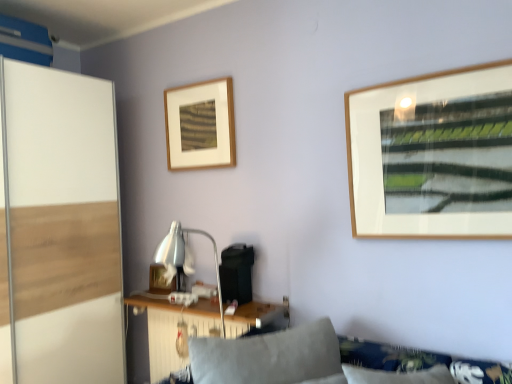
Locate an element on the screen. The width and height of the screenshot is (512, 384). wooden table at lower center is located at coordinates (170, 328).

Locate an element on the screen. This screenshot has width=512, height=384. wooden table at lower center is located at coordinates click(170, 328).

Is white glossy screen door at left taller than soft gray cushion at lower center?

Correct, white glossy screen door at left is much taller as soft gray cushion at lower center.

In the image, is white glossy screen door at left positioned in front of or behind soft gray cushion at lower center?

white glossy screen door at left is positioned farther from the viewer than soft gray cushion at lower center.

Is white glossy screen door at left positioned with its back to soft gray cushion at lower center?

No, soft gray cushion at lower center is not at the back of white glossy screen door at left.

From the image's perspective, is white glossy screen door at left over soft gray cushion at lower center?

Indeed, from the image's perspective, white glossy screen door at left is shown above soft gray cushion at lower center.

Are wooden picture frame at upper center, which is the first picture frame from right to left, and soft gray cushion at lower center located far from each other?

wooden picture frame at upper center, which is the first picture frame from right to left, is positioned a significant distance from soft gray cushion at lower center.

Considering the sizes of objects wooden picture frame at upper center, the 2th picture frame positioned from the bottom, and soft gray cushion at lower center in the image provided, who is shorter, wooden picture frame at upper center, the 2th picture frame positioned from the bottom, or soft gray cushion at lower center?

Standing shorter between the two is soft gray cushion at lower center.

Is wooden picture frame at upper center, the 1th picture frame when ordered from top to bottom, to the left or to the right of soft gray cushion at lower center in the image?

Clearly, wooden picture frame at upper center, the 1th picture frame when ordered from top to bottom, is on the left of soft gray cushion at lower center in the image.

Who is more distant, wooden picture frame at center, placed as the second picture frame when sorted from right to left, or white glossy screen door at left?

Positioned behind is wooden picture frame at center, placed as the second picture frame when sorted from right to left.

Which of these two, wooden picture frame at center, which ranks as the second picture frame in top-to-bottom order, or white glossy screen door at left, is bigger?

Bigger between the two is white glossy screen door at left.

Between wooden picture frame at center, placed as the second picture frame when sorted from right to left, and white glossy screen door at left, which one has smaller width?

wooden picture frame at center, placed as the second picture frame when sorted from right to left.

From a real-world perspective, who is located higher, wooden picture frame at center, which ranks as the second picture frame in top-to-bottom order, or white glossy screen door at left?

white glossy screen door at left.

In the scene shown: Is wooden picture frame at upper center, positioned as the 1th picture frame in front-to-back order, positioned behind wooden picture frame at center, which ranks as the second picture frame in top-to-bottom order?

That is False.

Which of these two, wooden picture frame at upper center, which is counted as the 2th picture frame, starting from the left, or wooden picture frame at center, placed as the second picture frame when sorted from right to left, is bigger?

Bigger between the two is wooden picture frame at upper center, which is counted as the 2th picture frame, starting from the left.

Which of these two, wooden picture frame at upper center, which is counted as the 2th picture frame, starting from the left, or wooden picture frame at center, arranged as the first picture frame when ordered from the bottom, is thinner?

wooden picture frame at center, arranged as the first picture frame when ordered from the bottom.

Does wooden picture frame at upper center, the 1th picture frame when ordered from top to bottom, have a greater height compared to wooden picture frame at center, which is the first picture frame from left to right?

Yes, wooden picture frame at upper center, the 1th picture frame when ordered from top to bottom, is taller than wooden picture frame at center, which is the first picture frame from left to right.

Consider the image. Is soft gray cushion at lower center placed right next to white glossy screen door at left?

soft gray cushion at lower center and white glossy screen door at left are not in contact.

Is soft gray cushion at lower center facing towards white glossy screen door at left?

No, soft gray cushion at lower center is not oriented towards white glossy screen door at left.

In the scene shown: From a real-world perspective, relative to white glossy screen door at left, is soft gray cushion at lower center vertically above or below?

soft gray cushion at lower center is situated lower than white glossy screen door at left in the real world.

In the image, is soft gray cushion at lower center on the left side or the right side of white glossy screen door at left?

From the image, it's evident that soft gray cushion at lower center is to the right of white glossy screen door at left.

Could you tell me if white glossy screen door at left is facing wooden table at lower center?

Yes, white glossy screen door at left is turned towards wooden table at lower center.

Where is `screen door that appears in front of the wooden table at lower center`? screen door that appears in front of the wooden table at lower center is located at coordinates (62, 225).

Is white glossy screen door at left placed right next to wooden table at lower center?

No, white glossy screen door at left is not making contact with wooden table at lower center.

From their relative heights in the image, would you say white glossy screen door at left is taller or shorter than wooden table at lower center?

Clearly, white glossy screen door at left is taller compared to wooden table at lower center.

How far apart are wooden picture frame at upper center, positioned as the 1th picture frame in front-to-back order, and wooden table at lower center?

The distance of wooden picture frame at upper center, positioned as the 1th picture frame in front-to-back order, from wooden table at lower center is 3.38 feet.

Does wooden picture frame at upper center, arranged as the 2th picture frame when viewed from the back, turn towards wooden table at lower center?

No, wooden picture frame at upper center, arranged as the 2th picture frame when viewed from the back, does not turn towards wooden table at lower center.

Is wooden picture frame at upper center, the 1th picture frame when ordered from top to bottom, in contact with wooden table at lower center?

No, wooden picture frame at upper center, the 1th picture frame when ordered from top to bottom, is not making contact with wooden table at lower center.

Does wooden picture frame at upper center, the 2th picture frame positioned from the bottom, contain wooden table at lower center?

Definitely not — wooden table at lower center is not inside wooden picture frame at upper center, the 2th picture frame positioned from the bottom.

The width and height of the screenshot is (512, 384). I want to click on screen door above the soft gray cushion at lower center (from a real-world perspective), so click(x=62, y=225).

In the image, there is a wooden picture frame at upper center, positioned as the 1th picture frame in front-to-back order. Identify the location of couch below it (from a real-world perspective). The height and width of the screenshot is (384, 512). (318, 361).

From the image, which object appears to be nearer to wooden table at lower center, soft gray cushion at lower center or white glossy screen door at left?

soft gray cushion at lower center is closer to wooden table at lower center.

Considering their positions, is wooden picture frame at center, placed as the second picture frame when sorted from right to left, positioned further to wooden table at lower center than wooden picture frame at upper center, the 2th picture frame positioned from the bottom?

wooden picture frame at upper center, the 2th picture frame positioned from the bottom, lies further to wooden table at lower center than the other object.

Estimate the real-world distances between objects in this image. Which object is closer to wooden picture frame at center, which ranks as the second picture frame in top-to-bottom order, wooden picture frame at upper center, which is the first picture frame from right to left, or soft gray cushion at lower center?

wooden picture frame at upper center, which is the first picture frame from right to left, is closer to wooden picture frame at center, which ranks as the second picture frame in top-to-bottom order.

From the image, which object appears to be nearer to white glossy screen door at left, soft gray cushion at lower center or wooden picture frame at upper center, arranged as the 2th picture frame when viewed from the back?

wooden picture frame at upper center, arranged as the 2th picture frame when viewed from the back, is positioned closer to the anchor white glossy screen door at left.

Estimate the real-world distances between objects in this image. Which object is closer to wooden picture frame at upper center, the 1th picture frame when ordered from top to bottom, wooden picture frame at center, arranged as the first picture frame when ordered from the bottom, or wooden table at lower center?

wooden picture frame at center, arranged as the first picture frame when ordered from the bottom, lies closer to wooden picture frame at upper center, the 1th picture frame when ordered from top to bottom, than the other object.

Estimate the real-world distances between objects in this image. Which object is closer to white glossy screen door at left, wooden picture frame at center, placed as the second picture frame when sorted from right to left, or wooden picture frame at upper center, arranged as the 2th picture frame when viewed from the back?

Among the two, wooden picture frame at center, placed as the second picture frame when sorted from right to left, is located nearer to white glossy screen door at left.

Which object lies nearer to the anchor point white glossy screen door at left, wooden picture frame at center, which is the first picture frame from left to right, or wooden table at lower center?

wooden table at lower center is positioned closer to the anchor white glossy screen door at left.

Estimate the real-world distances between objects in this image. Which object is further from wooden picture frame at upper center, positioned as the 1th picture frame in front-to-back order, white glossy screen door at left or wooden table at lower center?

wooden table at lower center is positioned further to the anchor wooden picture frame at upper center, positioned as the 1th picture frame in front-to-back order.

Identify the location of screen door between wooden picture frame at upper center, arranged as the 2th picture frame when viewed from the back, and wooden table at lower center vertically. [62, 225].

This screenshot has width=512, height=384. What are the coordinates of `screen door positioned between soft gray cushion at lower center and wooden picture frame at upper center, the 2th picture frame positioned from the bottom, from near to far` in the screenshot? It's located at (62, 225).

You are a GUI agent. You are given a task and a screenshot of the screen. Output one action in this format:
    pyautogui.click(x=<x>, y=<y>)
    Task: Click on the screen door located between soft gray cushion at lower center and wooden table at lower center in the depth direction
    
    Given the screenshot: What is the action you would take?
    pyautogui.click(x=62, y=225)

Where is `screen door between soft gray cushion at lower center and wooden picture frame at center, arranged as the first picture frame when ordered from the bottom, along the z-axis`? Image resolution: width=512 pixels, height=384 pixels. screen door between soft gray cushion at lower center and wooden picture frame at center, arranged as the first picture frame when ordered from the bottom, along the z-axis is located at coordinates (62, 225).